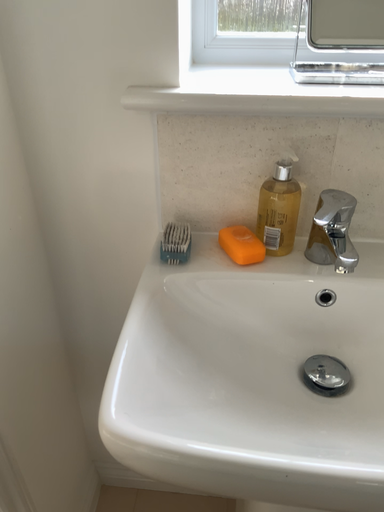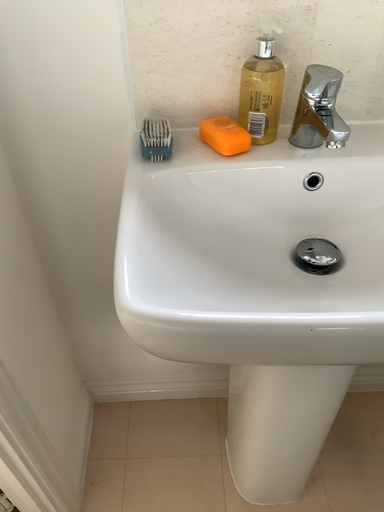
Question: Which way did the camera rotate in the video?

Choices:
 (A) rotated left
 (B) rotated right

Answer: (B)